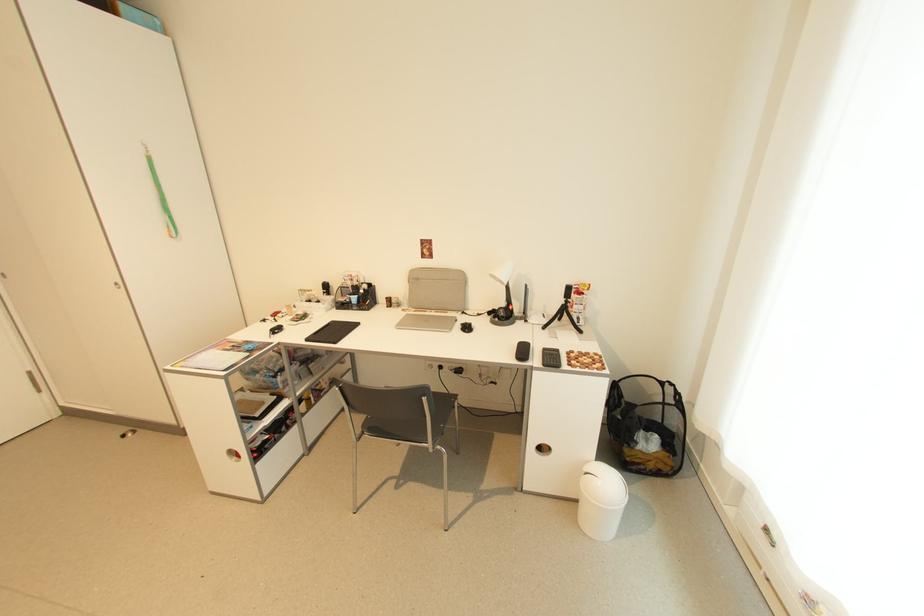
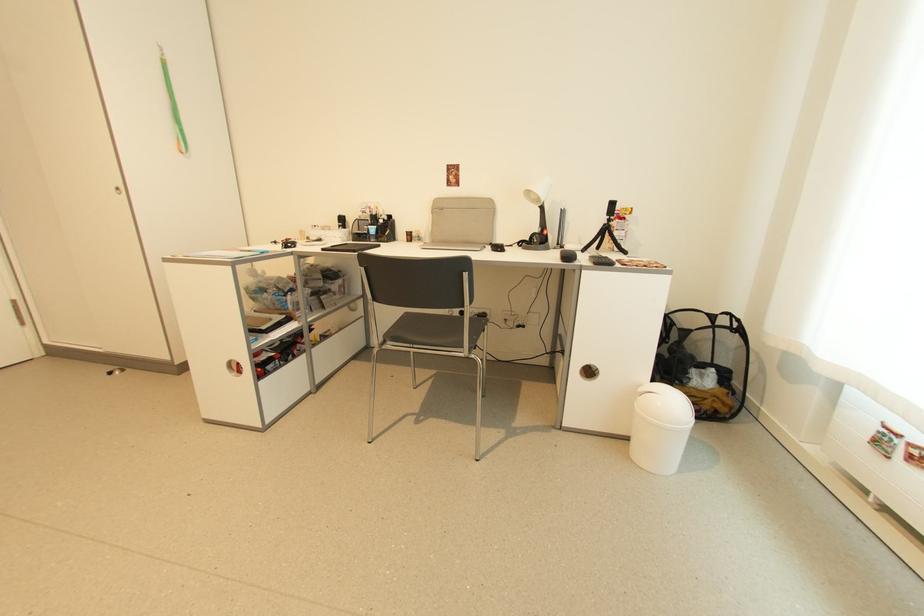
In the second image, find the point that corresponds to [175,233] in the first image.

(185, 146)